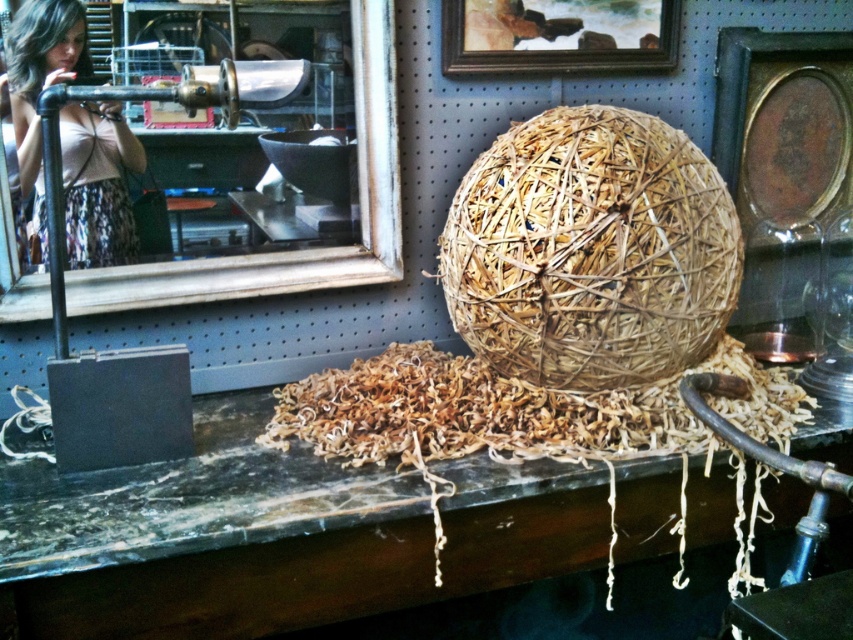
Who is higher up, brown marble table at center or wooden frame at upper center?

Positioned higher is wooden frame at upper center.

Is point (263, 483) positioned behind point (514, 61)?

No.

Who is more forward, (258, 452) or (662, 65)?

Point (258, 452) is more forward.

Find the location of `brown marble table at center`. brown marble table at center is located at coordinates (274, 534).

Find the location of a particular element. This screenshot has height=640, width=853. natural straw ball at center is located at coordinates [x=590, y=250].

Can you confirm if natural straw ball at center is smaller than matte black hair at upper left?

Actually, natural straw ball at center might be larger than matte black hair at upper left.

Is point (611, 278) farther from camera compared to point (30, 58)?

No, (611, 278) is closer to viewer.

Locate an element on the screen. The height and width of the screenshot is (640, 853). natural straw ball at center is located at coordinates [590, 250].

Is brown marble table at center to the left of matte black hair at upper left from the viewer's perspective?

In fact, brown marble table at center is to the right of matte black hair at upper left.

Can you confirm if brown marble table at center is positioned below matte black hair at upper left?

Indeed, brown marble table at center is positioned under matte black hair at upper left.

Measure the distance between brown marble table at center and camera.

A distance of 1.26 meters exists between brown marble table at center and camera.

The height and width of the screenshot is (640, 853). In order to click on brown marble table at center in this screenshot , I will do `click(274, 534)`.